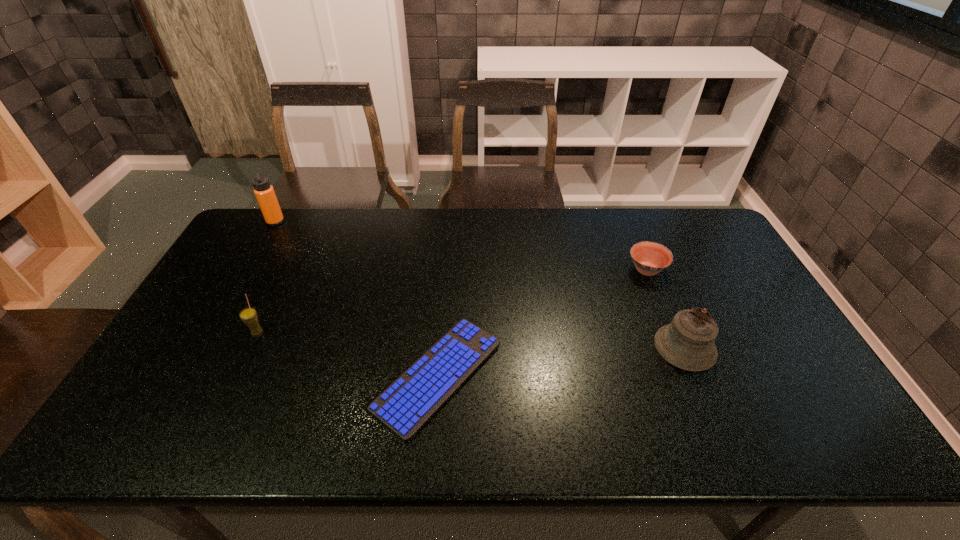
Where is `unoccupied position between the leftmost object and the bell`? Image resolution: width=960 pixels, height=540 pixels. unoccupied position between the leftmost object and the bell is located at coordinates (x=480, y=285).

Where is `vacant area between the bowl and the thermos bottle`? Image resolution: width=960 pixels, height=540 pixels. vacant area between the bowl and the thermos bottle is located at coordinates (461, 246).

At what (x,y) coordinates should I click in order to perform the action: click on free space that is in between the third object from right to left and the bell. Please return your answer as a coordinate pair (x, y). The width and height of the screenshot is (960, 540). Looking at the image, I should click on tap(562, 361).

The height and width of the screenshot is (540, 960). Identify the location of free spot between the fourth nearest object and the fourth object from right to left. (452, 301).

Choose which object is the third nearest neighbor to the straw for drinking. Please provide its 2D coordinates. Your answer should be formatted as a tuple, i.e. [(x, y)], where the tuple contains the x and y coordinates of a point satisfying the conditions above.

[(687, 343)]

Select which object is the third closest to the tallest object. Please provide its 2D coordinates. Your answer should be formatted as a tuple, i.e. [(x, y)], where the tuple contains the x and y coordinates of a point satisfying the conditions above.

[(650, 258)]

Identify the location of blank space that satisfies the following two spatial constraints: 1. on the back side of the third tallest object; 2. on the right side of the bowl. The height and width of the screenshot is (540, 960). (287, 270).

Identify the location of free space that satisfies the following two spatial constraints: 1. on the front side of the second farthest object; 2. on the right side of the bell. pos(678,347).

Where is `vacant area that satisfies the following two spatial constraints: 1. on the front side of the bell; 2. on the right side of the bowl`? The width and height of the screenshot is (960, 540). vacant area that satisfies the following two spatial constraints: 1. on the front side of the bell; 2. on the right side of the bowl is located at coordinates (678, 347).

This screenshot has width=960, height=540. I want to click on blank space that satisfies the following two spatial constraints: 1. on the front side of the fourth object from right to left; 2. on the right side of the thermos bottle, so click(212, 332).